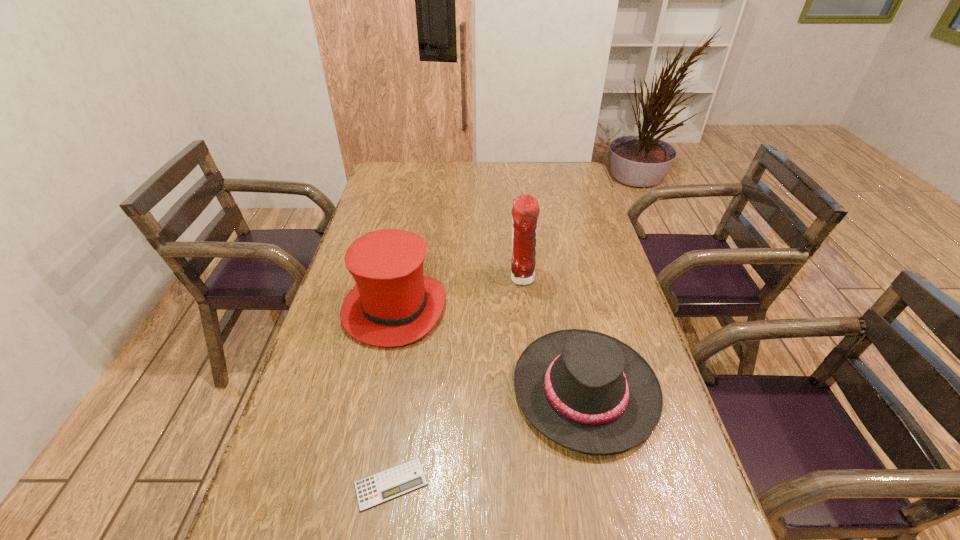
The image size is (960, 540). Find the location of `object positioned at the left edge`. object positioned at the left edge is located at coordinates (393, 303).

This screenshot has height=540, width=960. Identify the location of object that is at the right edge. 589,392.

Locate an element on the screen. The image size is (960, 540). free space at the far edge is located at coordinates (542, 167).

Find the location of `vacant region at the left edge of the desktop`. vacant region at the left edge of the desktop is located at coordinates (308, 374).

At what (x,y) coordinates should I click in order to perform the action: click on free region at the right edge. Please return your answer as a coordinate pair (x, y). This screenshot has height=540, width=960. Looking at the image, I should click on click(574, 221).

Identify the location of vacant position at the far right corner of the desktop. The height and width of the screenshot is (540, 960). (582, 179).

Identify the location of free spot between the shorter dress hat and the shortest object. [x=488, y=437].

The width and height of the screenshot is (960, 540). I want to click on free space between the shorter dress hat and the third shortest object, so click(x=490, y=349).

Identify the location of vacant space in between the shortest object and the condiment. The width and height of the screenshot is (960, 540). (456, 381).

Image resolution: width=960 pixels, height=540 pixels. What are the coordinates of `free point between the shortest object and the right dress hat` in the screenshot? It's located at (488, 437).